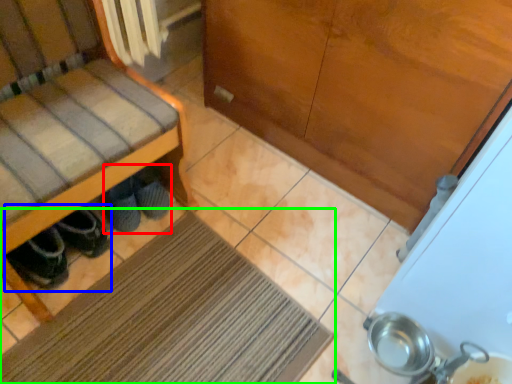
Question: Which is nearer to the footwear (highlighted by a red box)? footwear (highlighted by a blue box) or mat (highlighted by a green box).

Choices:
 (A) footwear
 (B) mat

Answer: (A)